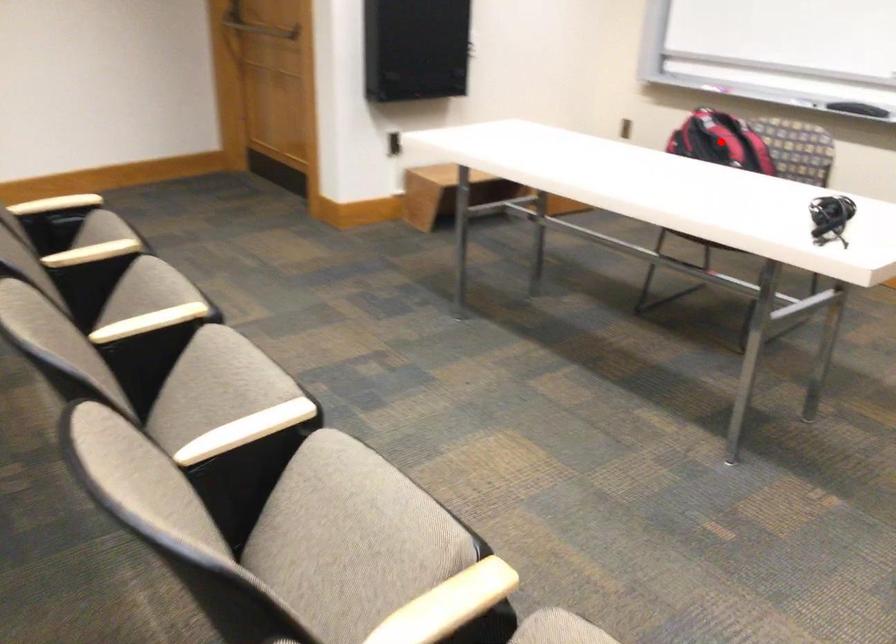
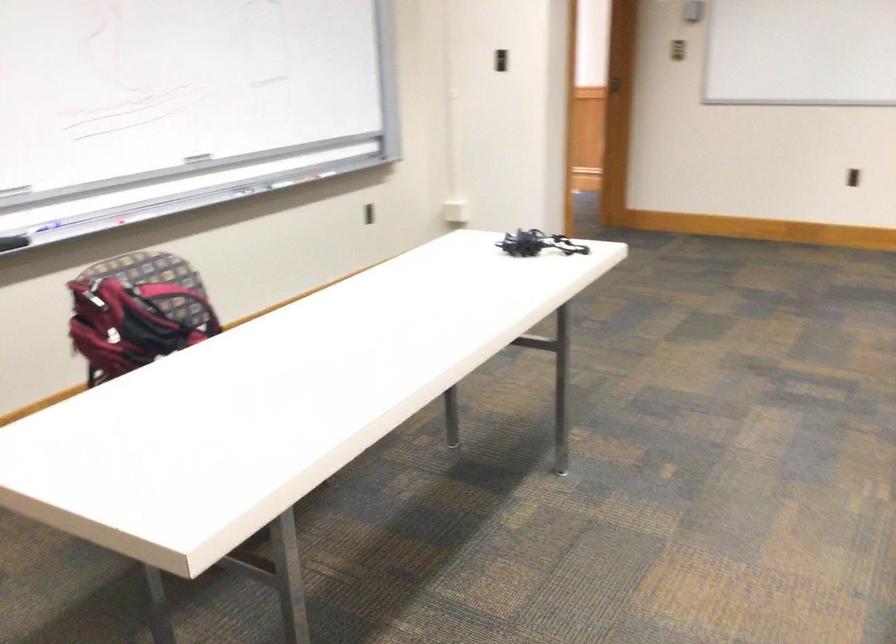
Question: I am providing you with two images of the same scene from different viewpoints. A red point is marked on the first image. Is the red point's position out of view in image 2?

Choices:
 (A) Yes
 (B) No

Answer: (A)